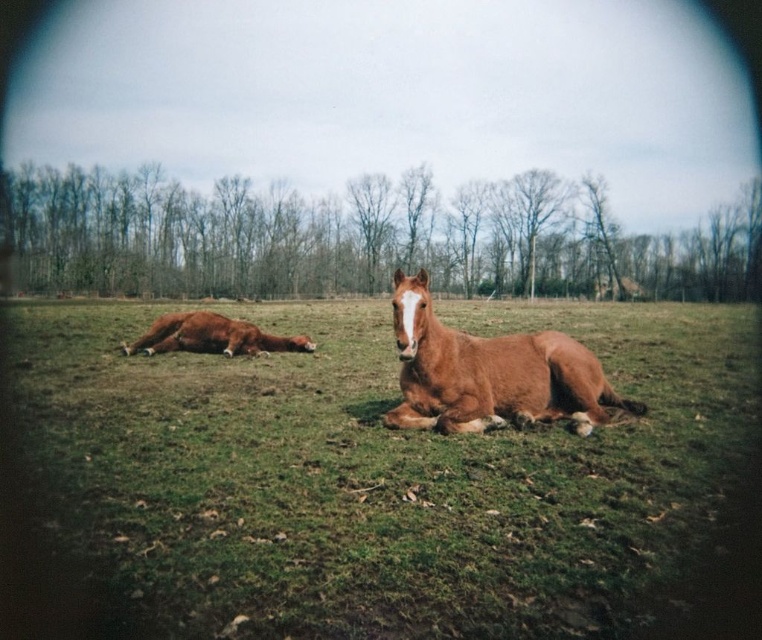
Question: Which point is closer to the camera?

Choices:
 (A) brown glossy horse at center
 (B) brown horse at center

Answer: (B)

Question: Is brown horse at center bigger than brown glossy horse at center?

Choices:
 (A) no
 (B) yes

Answer: (B)

Question: Which point is farther to the camera?

Choices:
 (A) (420, 324)
 (B) (248, 420)

Answer: (B)

Question: Is brown horse at center positioned before brown glossy horse at center?

Choices:
 (A) yes
 (B) no

Answer: (A)

Question: Is brown horse at center in front of brown glossy horse at center?

Choices:
 (A) yes
 (B) no

Answer: (A)